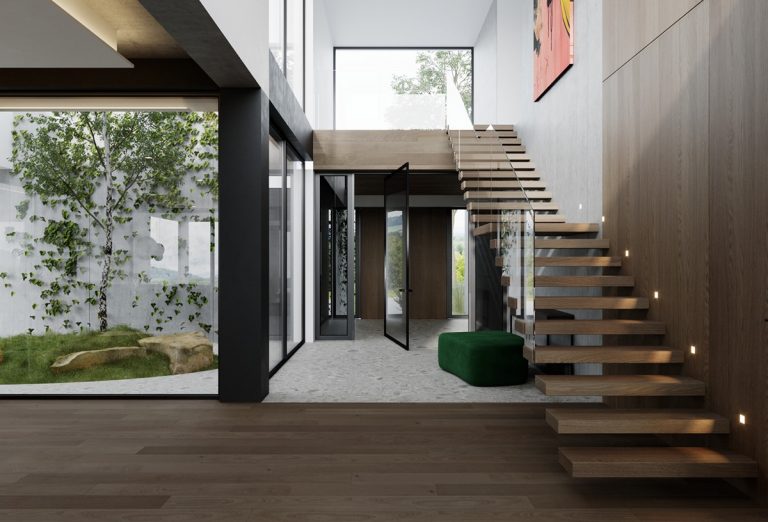
Where is `sliding doors`? The image size is (768, 522). sliding doors is located at coordinates (507, 511), (406, 298), (346, 288).